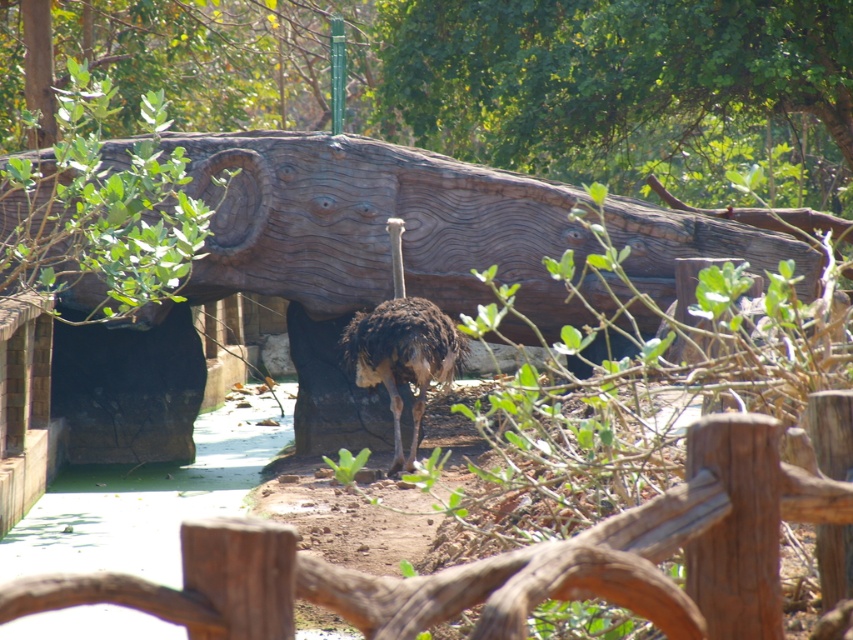
Can you confirm if brown wooden fence at center is bigger than brown feathered ostrich at center?

No.

Does brown wooden fence at center appear under brown feathered ostrich at center?

Yes, brown wooden fence at center is below brown feathered ostrich at center.

Where is `brown wooden fence at center`? The image size is (853, 640). brown wooden fence at center is located at coordinates (505, 561).

Can you confirm if wooden log at center is positioned above brown wooden fence at center?

Yes, wooden log at center is above brown wooden fence at center.

In the scene shown: Is wooden log at center wider than brown wooden fence at center?

Yes, wooden log at center is wider than brown wooden fence at center.

I want to click on wooden log at center, so click(376, 225).

The image size is (853, 640). Describe the element at coordinates (376, 225) in the screenshot. I see `wooden log at center` at that location.

Is wooden log at center smaller than brown feathered ostrich at center?

Incorrect, wooden log at center is not smaller in size than brown feathered ostrich at center.

Is point (212, 262) positioned in front of point (363, 353)?

No, (212, 262) is behind (363, 353).

Image resolution: width=853 pixels, height=640 pixels. What are the coordinates of `wooden log at center` in the screenshot? It's located at (376, 225).